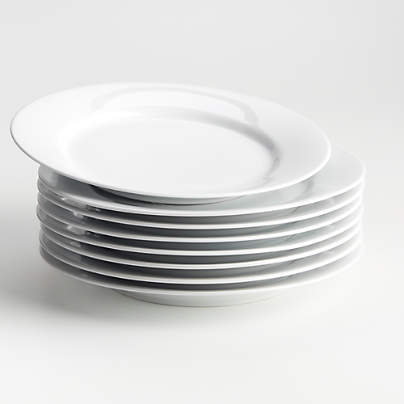
Where is `white plates in stack`? Image resolution: width=404 pixels, height=404 pixels. white plates in stack is located at coordinates (235, 295), (241, 281), (249, 265), (256, 255), (271, 237), (275, 224), (282, 210), (217, 183).